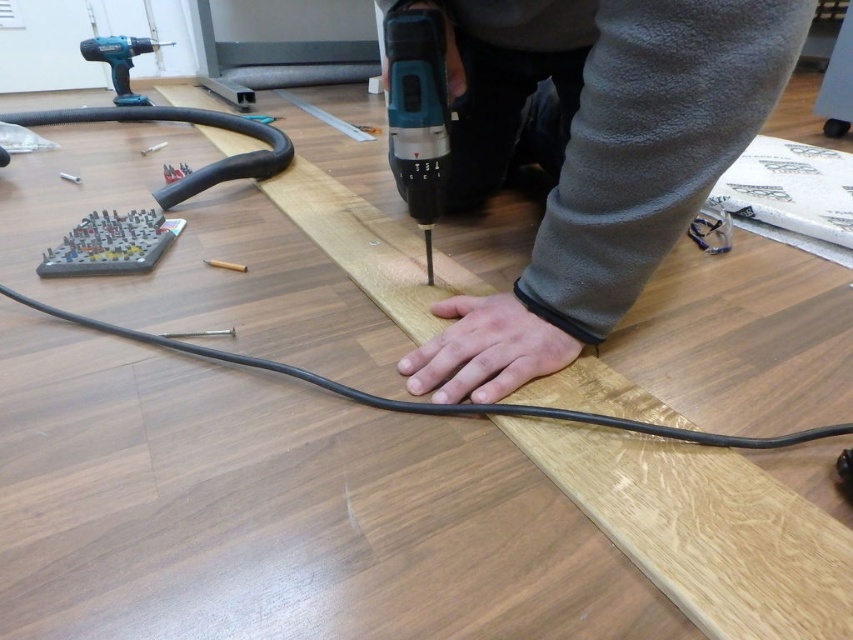
Question: Does smooth skin hand at center have a smaller size compared to blue plastic drill at upper left?

Choices:
 (A) no
 (B) yes

Answer: (B)

Question: Which of the following is the closest to the observer?

Choices:
 (A) blue plastic drill at center
 (B) gray matte hand at center
 (C) metallic drill bit at center
 (D) gray fleece pants at center

Answer: (D)

Question: Which object is positioned closest to the gray fleece pants at center?

Choices:
 (A) smooth skin hand at center
 (B) metallic drill bit at center

Answer: (A)

Question: Does blue plastic drill at center appear on the left side of gray matte hand at center?

Choices:
 (A) yes
 (B) no

Answer: (A)

Question: Estimate the real-world distances between objects in this image. Which object is closer to the gray matte hand at center?

Choices:
 (A) blue plastic drill at upper left
 (B) plastic game board at upper left

Answer: (B)

Question: Observing the image, what is the correct spatial positioning of smooth skin hand at center in reference to gray matte hand at center?

Choices:
 (A) above
 (B) below

Answer: (B)